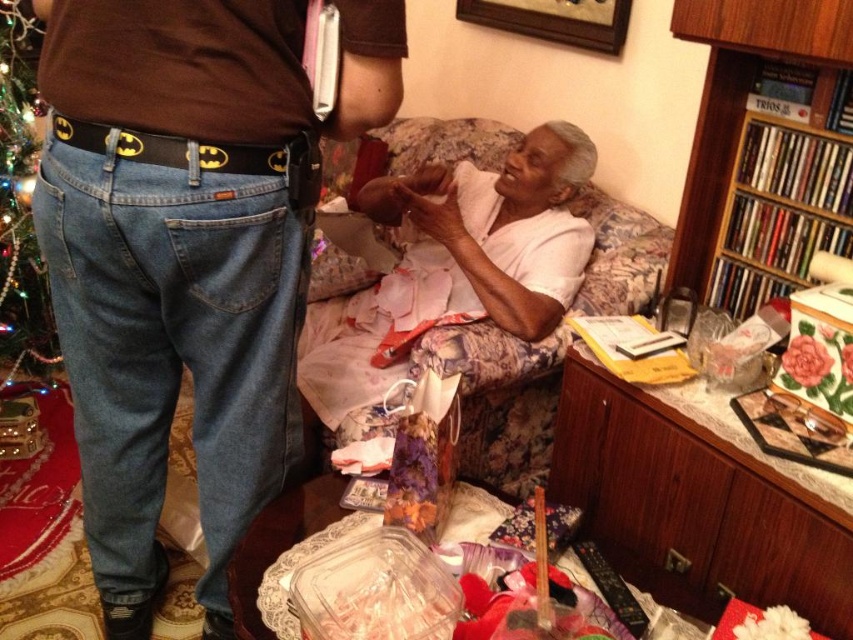
Question: Does denim jeans at center appear on the left side of green beaded christmas tree at left?

Choices:
 (A) no
 (B) yes

Answer: (A)

Question: Is floral fabric couch at center behind green beaded christmas tree at left?

Choices:
 (A) yes
 (B) no

Answer: (A)

Question: Is denim jeans at center to the left of green beaded christmas tree at left from the viewer's perspective?

Choices:
 (A) no
 (B) yes

Answer: (A)

Question: Which object appears farthest from the camera in this image?

Choices:
 (A) floral fabric couch at center
 (B) green beaded christmas tree at left
 (C) denim jeans at center

Answer: (A)

Question: Which point is farther from the camera taking this photo?

Choices:
 (A) (776, 259)
 (B) (368, 67)
 (C) (521, 417)

Answer: (C)

Question: Which point is farther to the camera?

Choices:
 (A) (38, 348)
 (B) (309, 205)
 (C) (544, 232)
 (D) (815, 150)

Answer: (A)